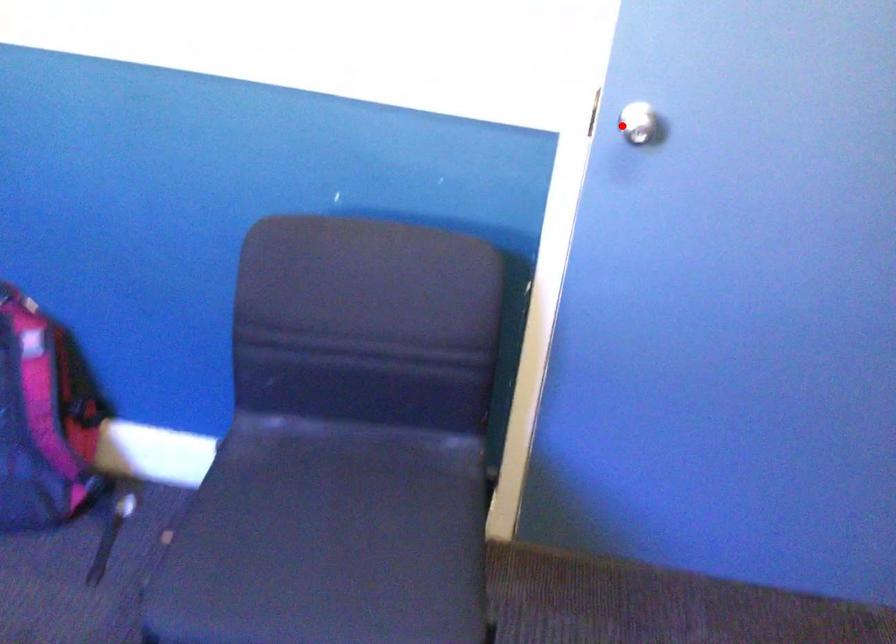
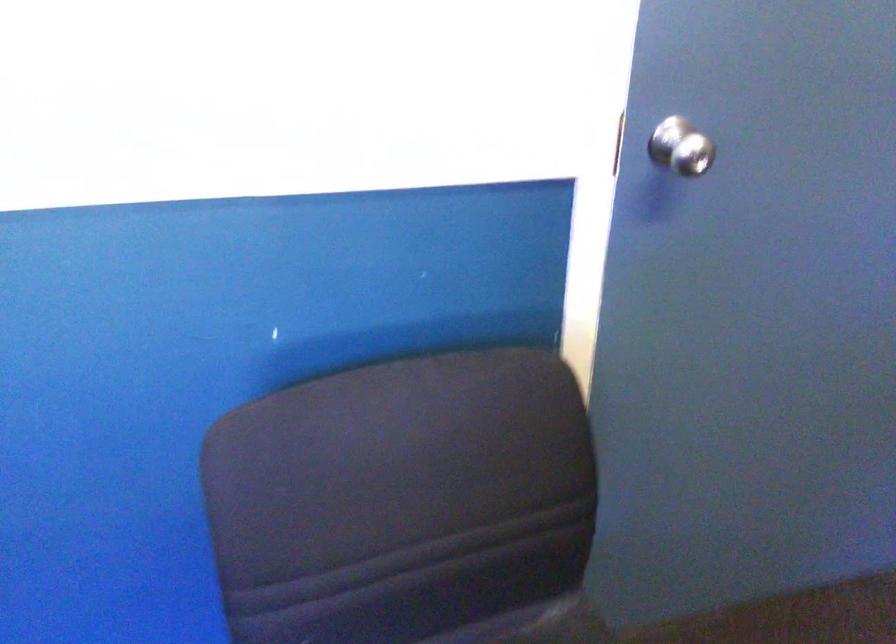
Question: I am providing you with two images of the same scene from different viewpoints. Image1 has a red point marked. In image2, the corresponding 3D location appears at what relative position? Reply with the corresponding letter.

Choices:
 (A) Closer
 (B) Farther

Answer: (A)